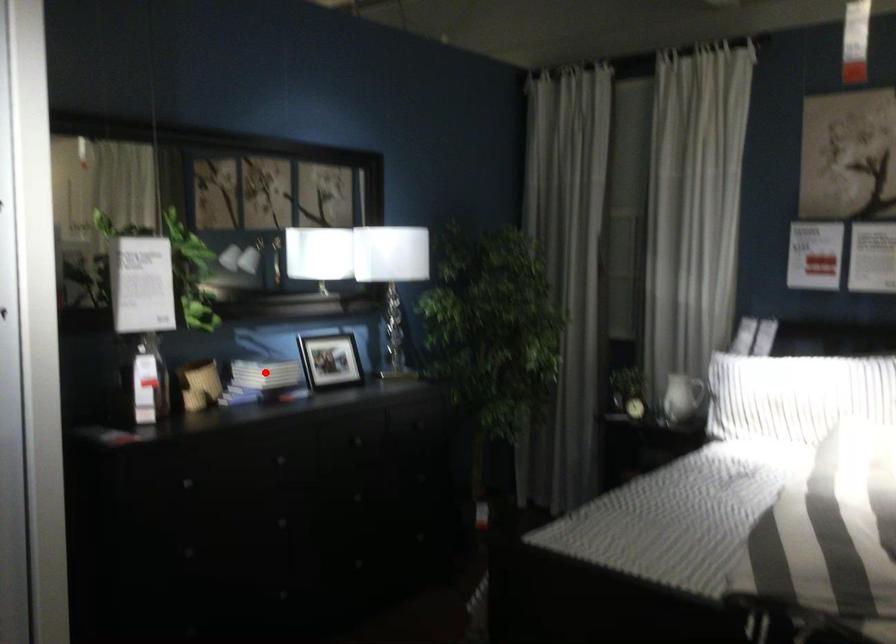
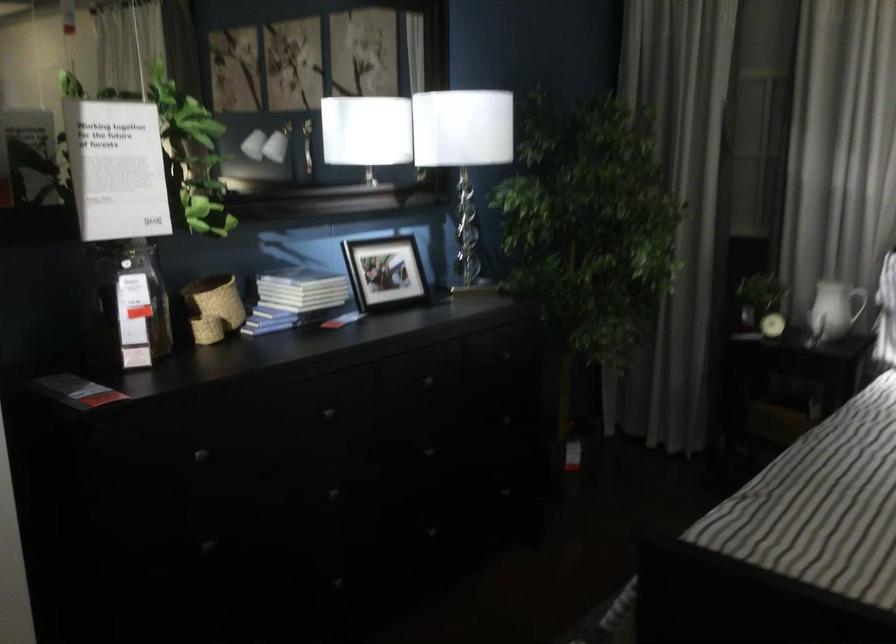
Question: I am providing you with two images of the same scene from different viewpoints. A red point is shown in image1. For the corresponding object point in image2, is it positioned nearer or farther from the camera?

Choices:
 (A) Nearer
 (B) Farther

Answer: (A)